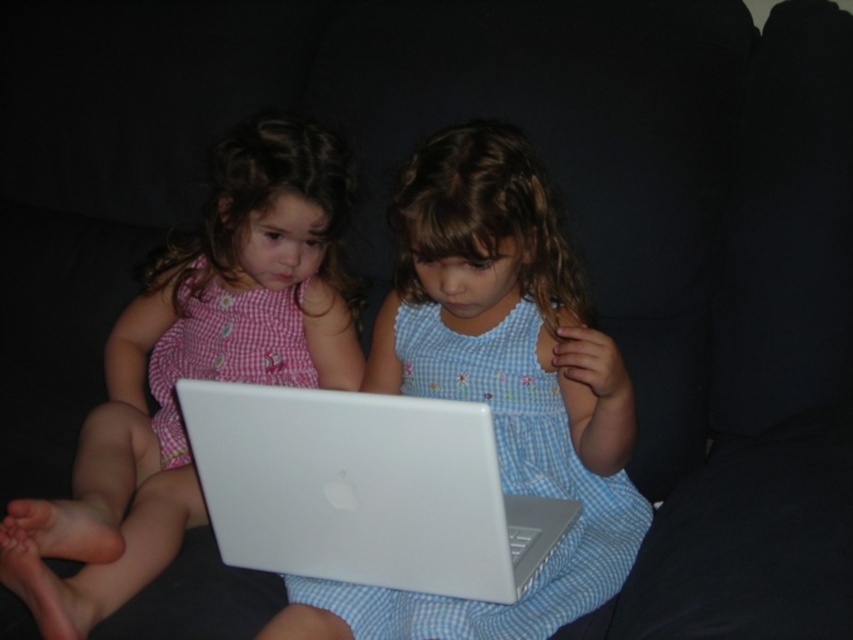
Is matte white laptop at center shorter than matte pink dress at center?

Yes, matte white laptop at center is shorter than matte pink dress at center.

Can you confirm if matte white laptop at center is smaller than matte pink dress at center?

Correct, matte white laptop at center occupies less space than matte pink dress at center.

The height and width of the screenshot is (640, 853). Identify the location of matte white laptop at center. (495, 387).

You are a GUI agent. You are given a task and a screenshot of the screen. Output one action in this format:
    pyautogui.click(x=<x>, y=<y>)
    Task: Click on the matte white laptop at center
    The width and height of the screenshot is (853, 640).
    Given the screenshot: What is the action you would take?
    pyautogui.click(x=495, y=387)

Is matte pink dress at center positioned behind white glossy laptop at center?

Yes, matte pink dress at center is behind white glossy laptop at center.

Who is shorter, matte pink dress at center or white glossy laptop at center?

With less height is white glossy laptop at center.

Which is in front, point (225, 260) or point (390, 548)?

Point (390, 548)

Where is `matte pink dress at center`? matte pink dress at center is located at coordinates (196, 365).

Can you confirm if matte white laptop at center is smaller than white glossy laptop at center?

No, matte white laptop at center is not smaller than white glossy laptop at center.

Is point (555, 467) more distant than point (198, 436)?

That is True.

Which is behind, point (546, 490) or point (279, 541)?

Positioned behind is point (546, 490).

Locate an element on the screen. matte white laptop at center is located at coordinates (495, 387).